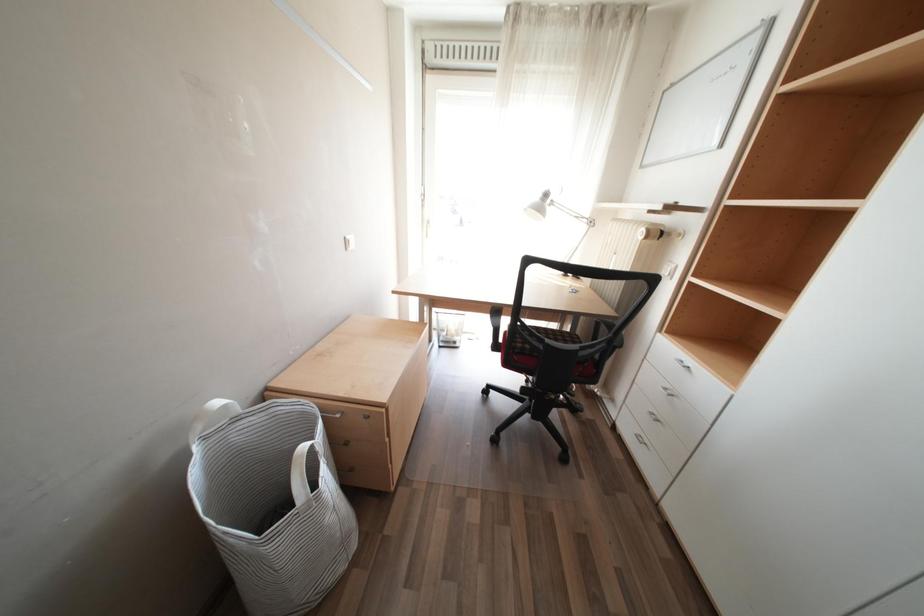
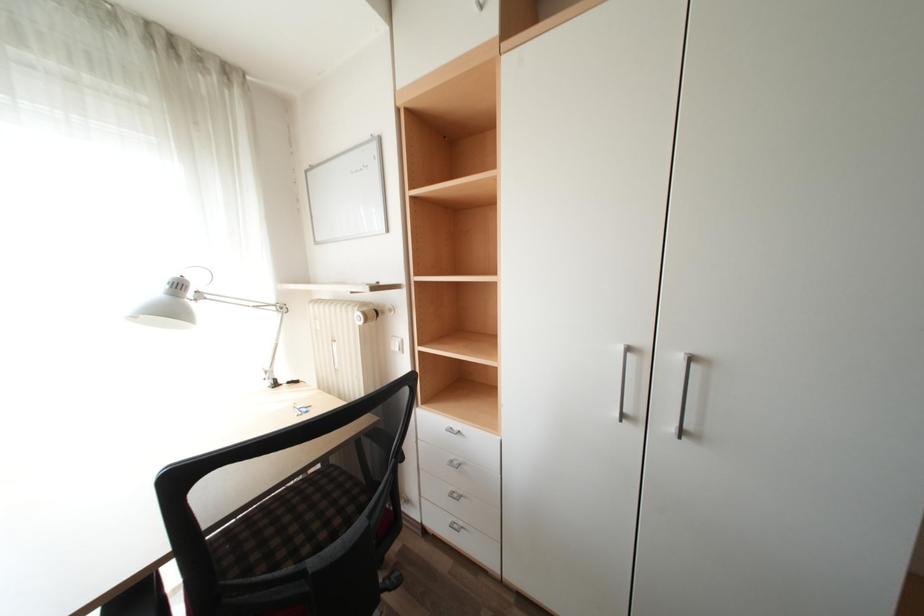
Question: How did the camera likely rotate?

Choices:
 (A) Left
 (B) Right
 (C) Up
 (D) Down

Answer: (B)